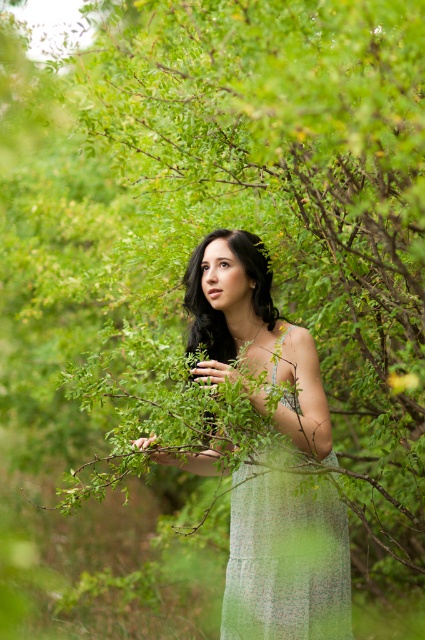
Question: Can you confirm if light green textured dress at center is bigger than light green sheer dress at center?

Choices:
 (A) no
 (B) yes

Answer: (B)

Question: From the image, what is the correct spatial relationship of light green textured dress at center in relation to light green sheer dress at center?

Choices:
 (A) left
 (B) right

Answer: (A)

Question: Which of the following is the closest to the observer?

Choices:
 (A) light green sheer dress at center
 (B) light green textured dress at center

Answer: (B)

Question: Does light green textured dress at center appear on the left side of light green sheer dress at center?

Choices:
 (A) no
 (B) yes

Answer: (B)